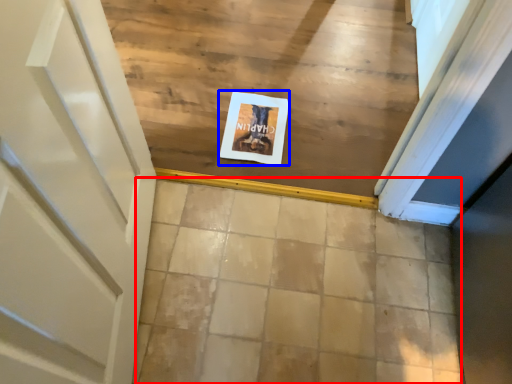
Question: Which object appears closest to the camera in this image, tile (highlighted by a red box) or postcard (highlighted by a blue box)?

Choices:
 (A) tile
 (B) postcard

Answer: (A)